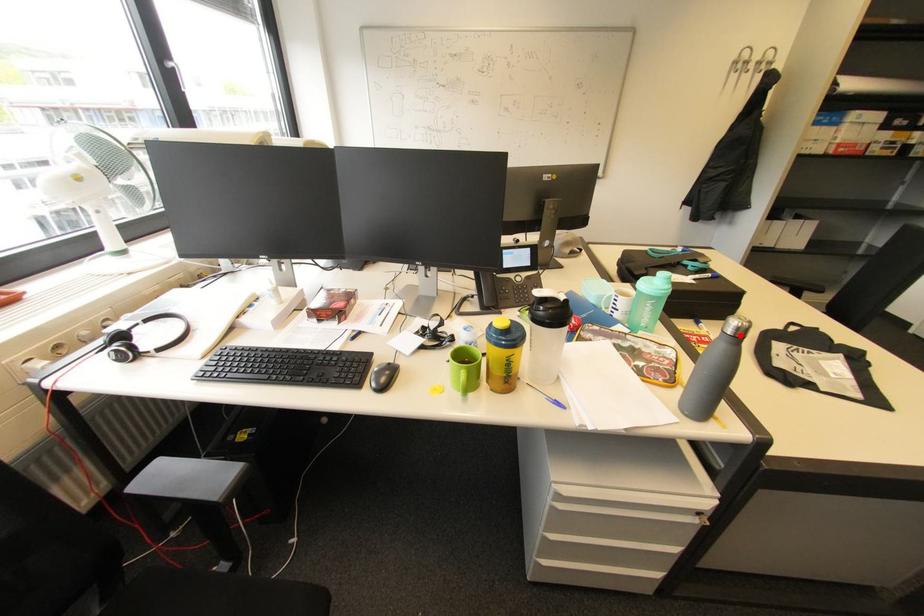
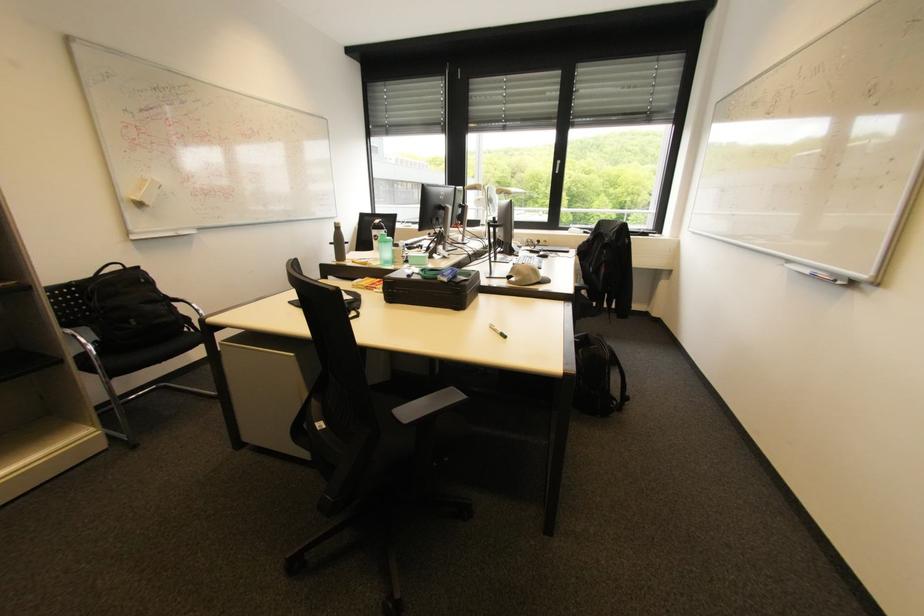
Question: I am providing you with two images of the same scene from different viewpoints. In image1, a red point is highlighted. Considering the same 3D point in image2, which of the following is correct?

Choices:
 (A) It is closer
 (B) It is farther

Answer: (A)